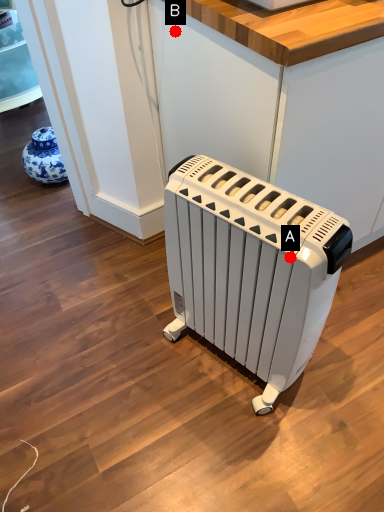
Question: Two points are circled on the image, labeled by A and B beside each circle. Which point appears farthest from the camera in this image?

Choices:
 (A) A is further
 (B) B is further

Answer: (B)